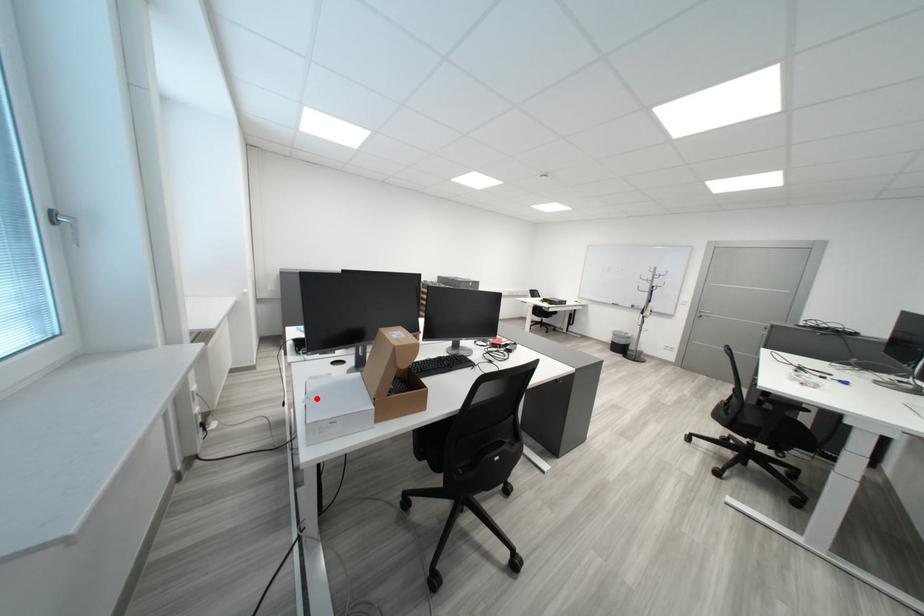
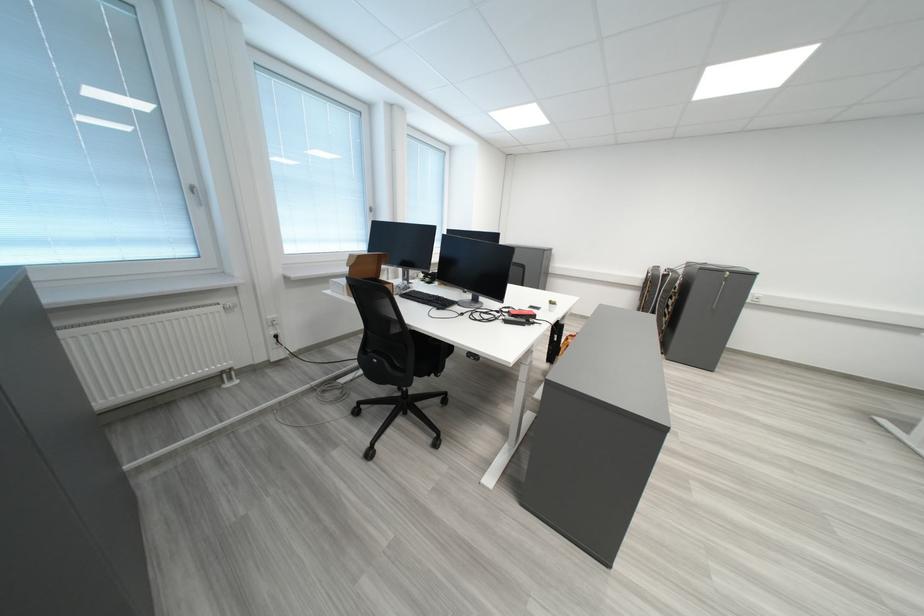
Question: I am providing you with two images of the same scene from different viewpoints. A red point is marked on the first image. At the location where the point appears in image 1, is it still visible in image 2?

Choices:
 (A) Yes
 (B) No

Answer: (B)